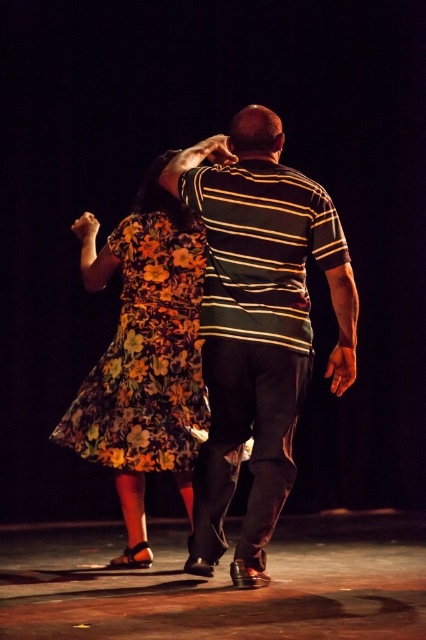
Question: Can you confirm if striped cotton shirt at center is positioned below floral-patterned fabric dress at center?

Choices:
 (A) no
 (B) yes

Answer: (B)

Question: Is striped cotton shirt at center to the right of floral-patterned fabric dress at center from the viewer's perspective?

Choices:
 (A) yes
 (B) no

Answer: (A)

Question: Which point is farther from the camera taking this photo?

Choices:
 (A) (256, 118)
 (B) (127, 284)

Answer: (B)

Question: Is striped cotton shirt at center to the left of floral-patterned fabric dress at center from the viewer's perspective?

Choices:
 (A) no
 (B) yes

Answer: (A)

Question: Which of the following is the closest to the observer?

Choices:
 (A) (181, 305)
 (B) (249, 154)

Answer: (B)